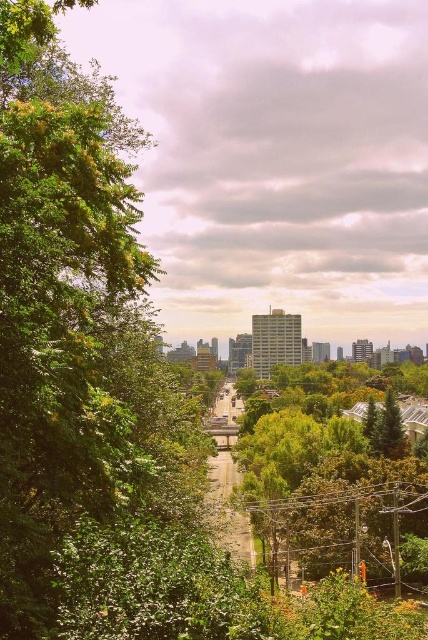
Which is below, green leafy tree at left or green textured pine tree at center-right?

green textured pine tree at center-right

Between point (20, 568) and point (386, 419), which one is positioned in front?

Point (386, 419) is more forward.

Is point (86, 420) less distant than point (385, 408)?

That is False.

You are a GUI agent. You are given a task and a screenshot of the screen. Output one action in this format:
    pyautogui.click(x=<x>, y=<y>)
    Task: Click on the green leafy tree at left
    
    Given the screenshot: What is the action you would take?
    pyautogui.click(x=67, y=310)

Does green leafy tree at center appear on the right side of green textured pine tree at center-right?

No, green leafy tree at center is not to the right of green textured pine tree at center-right.

Is point (267, 472) closer to viewer compared to point (382, 432)?

No, it is behind (382, 432).

At what (x,y) coordinates should I click in order to perform the action: click on green leafy tree at center. Please return your answer as a coordinate pair (x, y). Image resolution: width=428 pixels, height=640 pixels. Looking at the image, I should click on (332, 474).

Who is more distant from viewer, (12, 484) or (302, 512)?

Point (12, 484)

Where is `green leafy tree at left`? The height and width of the screenshot is (640, 428). green leafy tree at left is located at coordinates (67, 310).

Identify the location of green leafy tree at left. (67, 310).